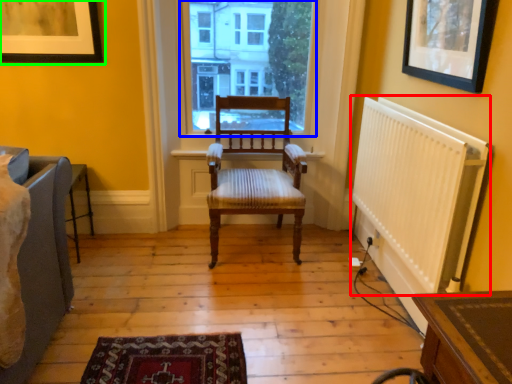
Question: Which is farther away from radiator (highlighted by a red box)? window (highlighted by a blue box) or picture frame (highlighted by a green box)?

Choices:
 (A) window
 (B) picture frame

Answer: (B)